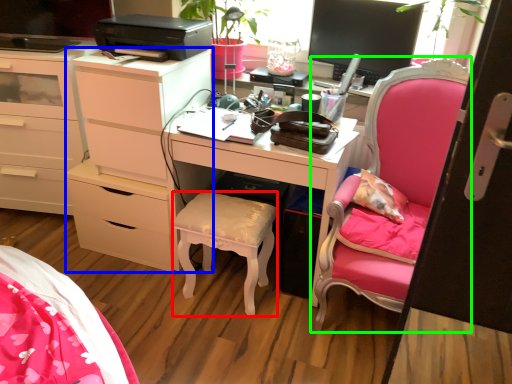
Question: Based on their relative distances, which object is nearer to stool (highlighted by a red box)? Choose from chest of drawers (highlighted by a blue box) and chair (highlighted by a green box).

Choices:
 (A) chest of drawers
 (B) chair

Answer: (A)